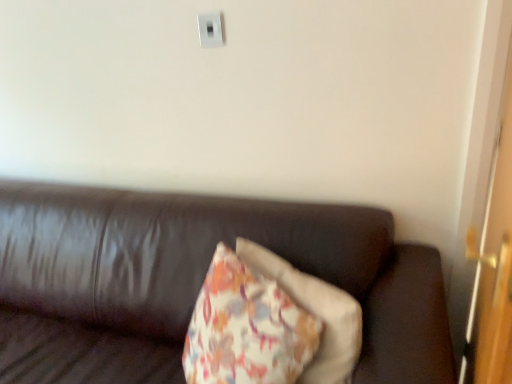
Question: Is white plastic switch at upper center bigger or smaller than leather couch at center?

Choices:
 (A) big
 (B) small

Answer: (B)

Question: Would you say white plastic switch at upper center is inside or outside leather couch at center?

Choices:
 (A) outside
 (B) inside

Answer: (A)

Question: Estimate the real-world distances between objects in this image. Which object is farther from the leather couch at center?

Choices:
 (A) white plastic switch at upper center
 (B) wooden door at right

Answer: (A)

Question: Based on their relative distances, which object is farther from the wooden door at right?

Choices:
 (A) leather couch at center
 (B) white plastic switch at upper center

Answer: (B)